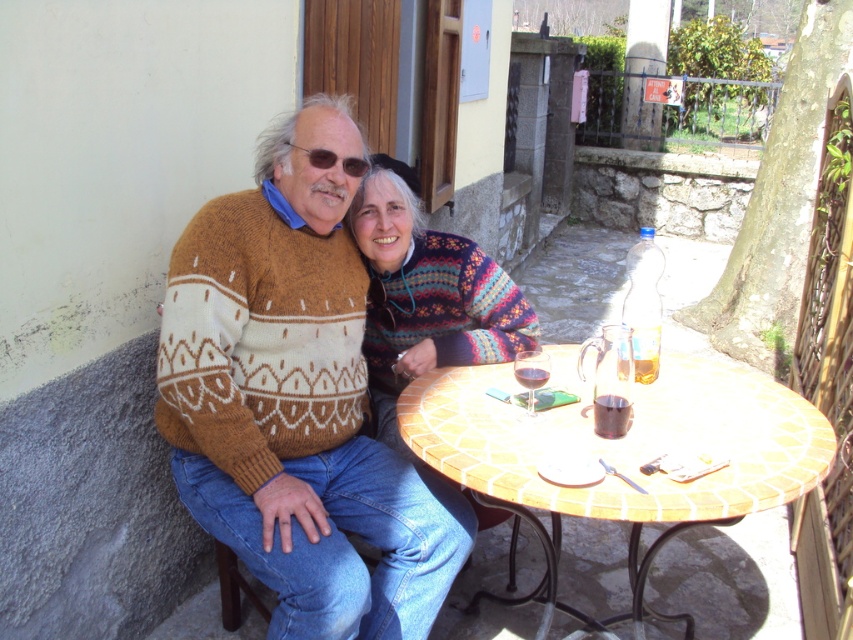
The width and height of the screenshot is (853, 640). I want to click on knitted sweater at left, so click(x=296, y=397).

Between knitted sweater at left and translucent glass pitcher at table center, which one is positioned lower?

translucent glass pitcher at table center is below.

The width and height of the screenshot is (853, 640). What do you see at coordinates (296, 397) in the screenshot?
I see `knitted sweater at left` at bounding box center [296, 397].

Find the location of a particular element. This screenshot has height=640, width=853. knitted sweater at left is located at coordinates (296, 397).

Does terracotta mosaic table at center lie in front of translucent glass pitcher at table center?

Yes.

Does point (584, 516) lie in front of point (646, 378)?

Yes, it is in front of point (646, 378).

This screenshot has width=853, height=640. What are the coordinates of `terracotta mosaic table at center` in the screenshot? It's located at (619, 452).

Is terracotta mosaic table at center further to the viewer compared to translucent glass at table center?

No, terracotta mosaic table at center is closer to the viewer.

Identify the location of terracotta mosaic table at center. Image resolution: width=853 pixels, height=640 pixels. pos(619,452).

At what (x,y) coordinates should I click in order to perform the action: click on terracotta mosaic table at center. Please return your answer as a coordinate pair (x, y). Looking at the image, I should click on (619, 452).